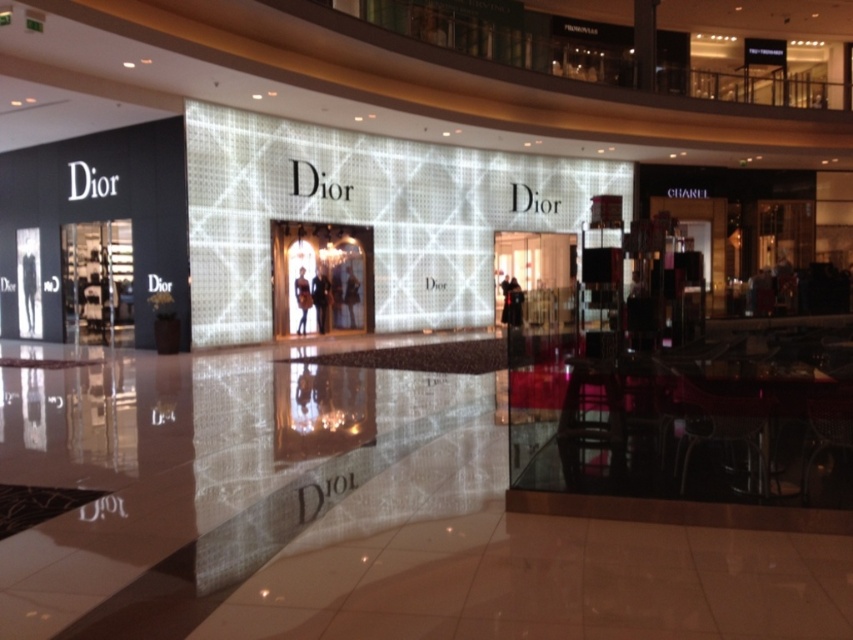
Can you confirm if dark fabric coat at center is bigger than matte black dress at center?

Indeed, dark fabric coat at center has a larger size compared to matte black dress at center.

Who is shorter, dark fabric coat at center or matte black dress at center?

matte black dress at center

Is point (321, 321) positioned before point (306, 300)?

No.

I want to click on dark fabric coat at center, so click(x=320, y=300).